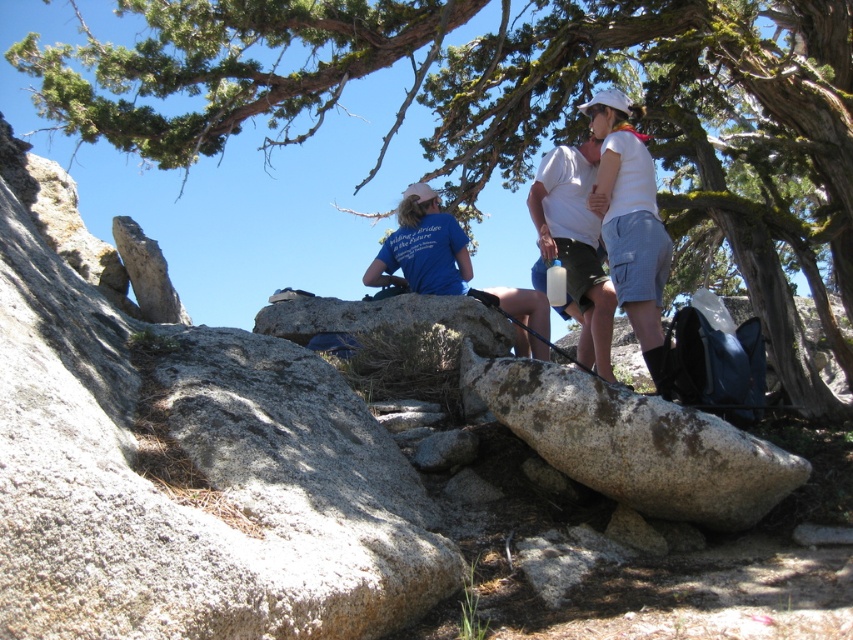
Does gray rough rock at center have a lesser width compared to blue fabric shirt at center?

Yes, gray rough rock at center is thinner than blue fabric shirt at center.

Can you confirm if gray rough rock at center is positioned below blue fabric shirt at center?

Incorrect, gray rough rock at center is not positioned below blue fabric shirt at center.

Is point (10, 385) positioned in front of point (463, 280)?

Yes, it is in front of point (463, 280).

Find the location of a particular element. This screenshot has width=853, height=640. gray rough rock at center is located at coordinates [x=183, y=458].

Does gray rough rock at center appear on the left side of white matte shirt at upper center?

Yes, gray rough rock at center is to the left of white matte shirt at upper center.

Which is in front, point (175, 376) or point (555, 230)?

Point (175, 376) is in front.

Identify the location of gray rough rock at center. (183, 458).

Who is higher up, white cotton shirt at center or white matte shirt at upper center?

white cotton shirt at center

Can you confirm if white cotton shirt at center is shorter than white matte shirt at upper center?

Incorrect, white cotton shirt at center's height does not fall short of white matte shirt at upper center's.

Where is `white cotton shirt at center`? white cotton shirt at center is located at coordinates (630, 220).

The image size is (853, 640). I want to click on white cotton shirt at center, so click(x=630, y=220).